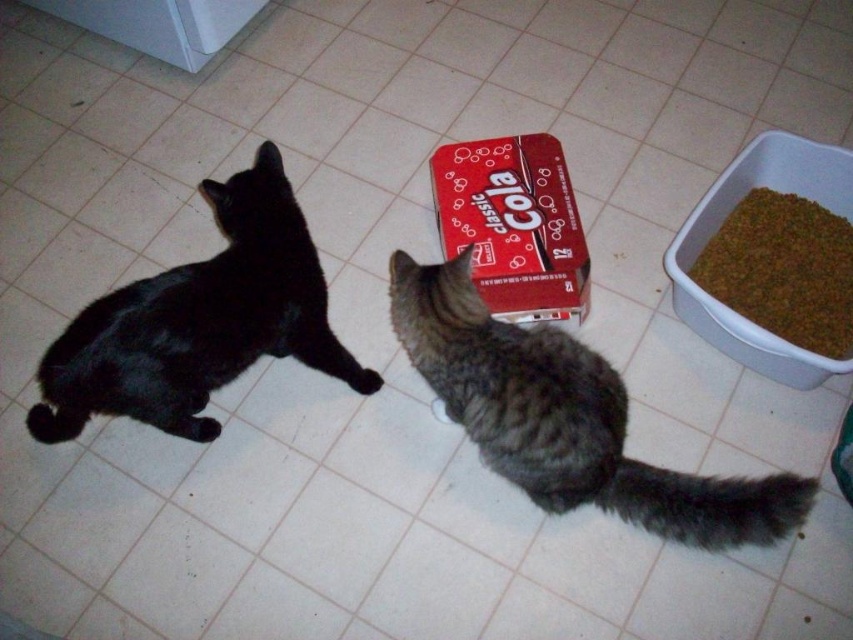
Question: Which is nearer to the matte black cat at left?

Choices:
 (A) red cardboard box at center
 (B) gray striped fur cat at center

Answer: (B)

Question: Among these points, which one is nearest to the camera?

Choices:
 (A) (49, 353)
 (B) (509, 300)
 (C) (756, 298)
 (D) (764, 509)

Answer: (D)

Question: Is gray striped fur cat at center below red cardboard box at center?

Choices:
 (A) yes
 (B) no

Answer: (A)

Question: Can you confirm if red cardboard box at center is positioned above brown granular food at right?

Choices:
 (A) no
 (B) yes

Answer: (B)

Question: Among these points, which one is nearest to the camera?

Choices:
 (A) (160, 275)
 (B) (525, 202)

Answer: (A)

Question: Does gray striped fur cat at center appear on the right side of matte black cat at left?

Choices:
 (A) yes
 (B) no

Answer: (A)